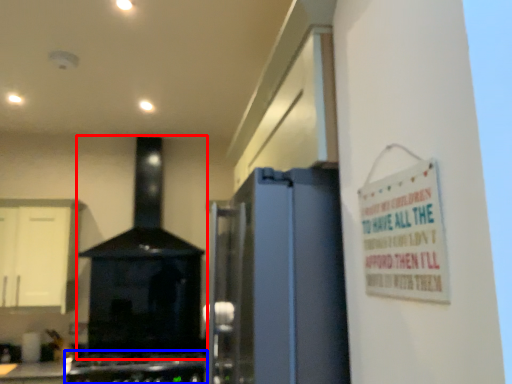
Question: Which object appears farthest to the camera in this image, home appliance (highlighted by a red box) or gas stove (highlighted by a blue box)?

Choices:
 (A) home appliance
 (B) gas stove

Answer: (A)